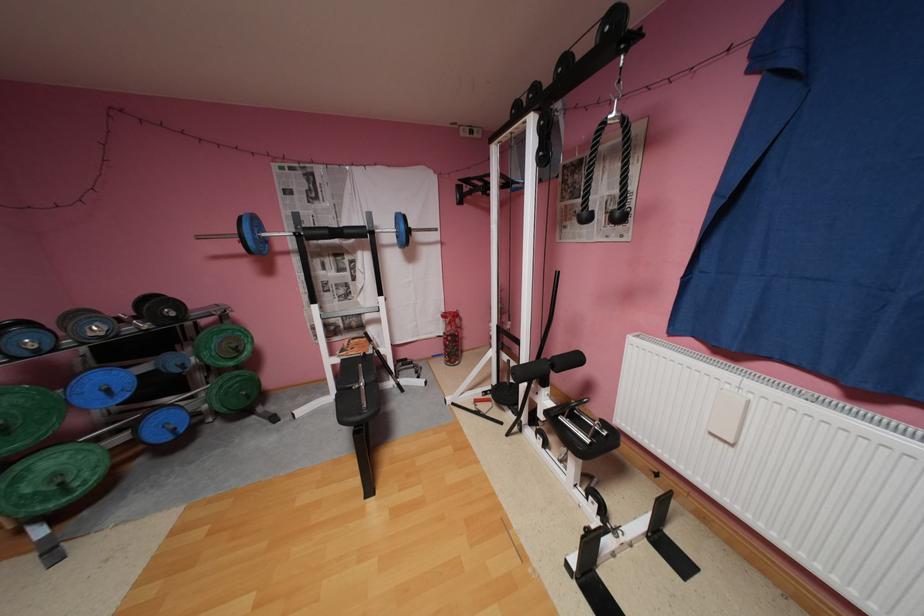
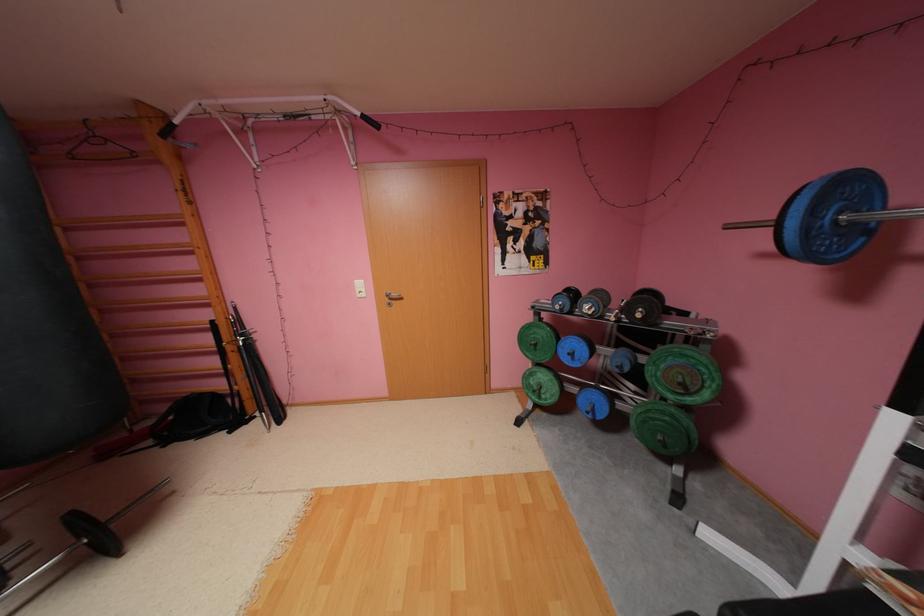
Where in the second image is the point corresponding to point 181,314 from the first image?

(648, 315)